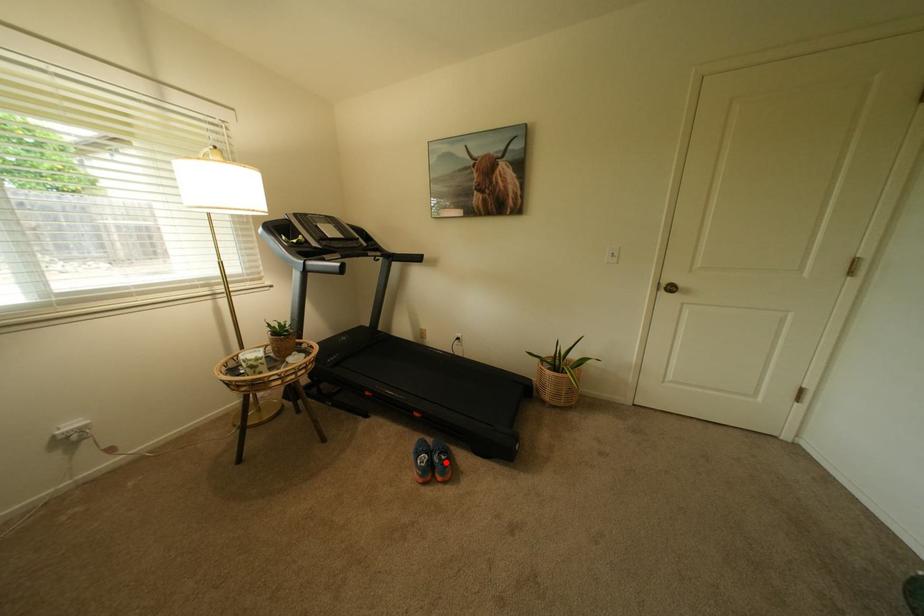
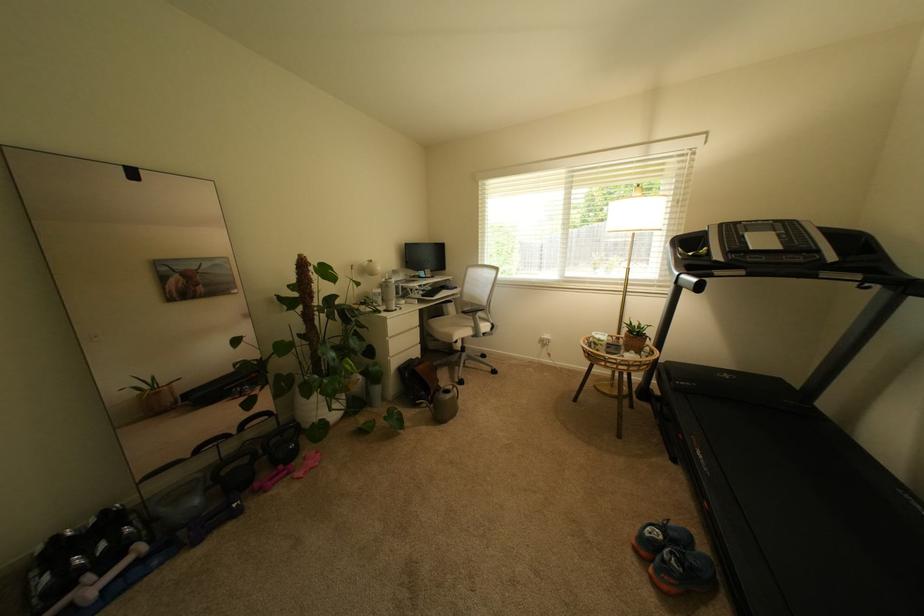
Question: I am providing you with two images of the same scene from different viewpoints. Given a red point in image1, look at the same physical point in image2. Is it:

Choices:
 (A) Closer to the viewpoint
 (B) Farther from the viewpoint

Answer: (B)